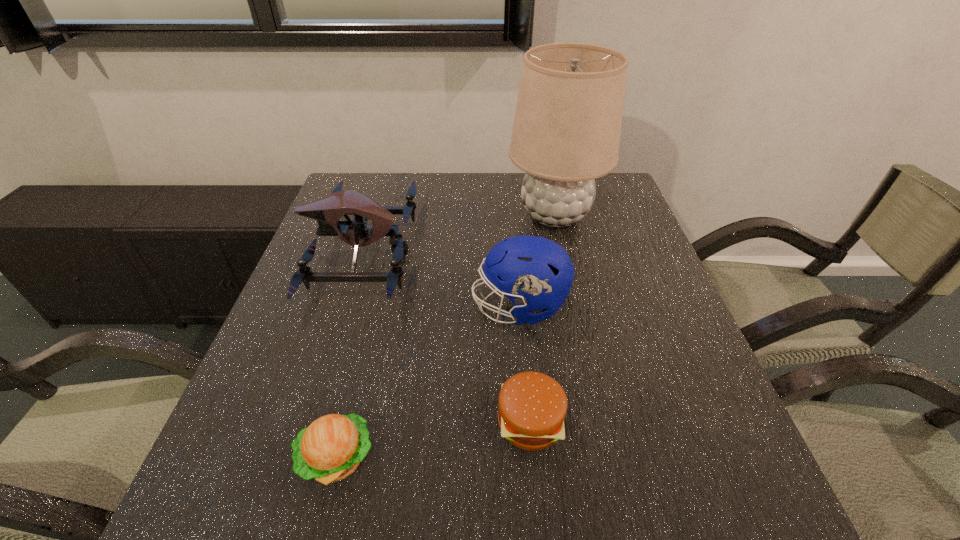
I want to click on object situated at the far right corner, so click(566, 133).

Image resolution: width=960 pixels, height=540 pixels. Identify the location of vacant space at the far edge of the desktop. (485, 178).

The image size is (960, 540). In the image, there is a desktop. Find the location of `vacant space at the near edge`. vacant space at the near edge is located at coordinates (461, 481).

Where is `free space at the left edge`? free space at the left edge is located at coordinates (290, 341).

I want to click on vacant region at the right edge of the desktop, so click(x=622, y=259).

Identify the location of free space between the drone and the tallest object. tap(458, 234).

You are a GUI agent. You are given a task and a screenshot of the screen. Output one action in this format:
    pyautogui.click(x=<x>, y=<y>)
    Task: Click on the empty space between the football helmet and the left hamburger
    
    Given the screenshot: What is the action you would take?
    pyautogui.click(x=428, y=383)

Identify the location of empty space between the lampshade and the drone. The height and width of the screenshot is (540, 960). (458, 234).

You are a GUI agent. You are given a task and a screenshot of the screen. Output one action in this format:
    pyautogui.click(x=<x>, y=<y>)
    Task: Click on the free space that is in between the right hamburger and the football helmet
    
    Given the screenshot: What is the action you would take?
    pyautogui.click(x=525, y=364)

Locate an element on the screen. This screenshot has width=960, height=540. vacant space that's between the drone and the football helmet is located at coordinates (440, 280).